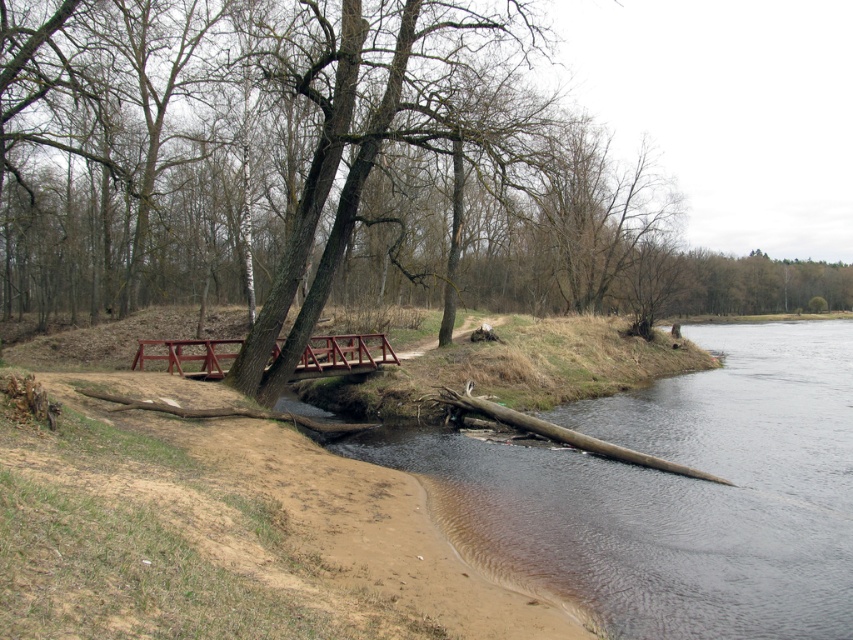
You are a hiker who wants to cross the river using the available structures. Can you use the metallic red bridge at center and the brown wood log at lower right to cross the river? Please explain your reasoning based on their sizes.

The metallic red bridge at center is larger in size than the brown wood log at lower right. Since the bridge is larger and more stable, it would be the safer option for crossing the river. The log might be too small or unstable for safe passage.

You are a hiker who wants to cross the river but need to avoid getting your boots wet. You see the metallic red bridge at center and the brown wood log at lower right. Which one can you use to cross the river without getting wet?

The metallic red bridge at center is located above brown wood log at lower right, so the metallic red bridge at center can be used to cross the river without getting wet since it is elevated above the water.

Consider the image. You are standing on the riverbank and want to cross to the other side. The metallic red bridge at center is the only structure available. Is the bridge located near the water or on the grassy area?

The metallic red bridge at center is located near the water because its 2D coordinates at point (343, 355) place it centrally over the stream flowing into the river, which is closer to the water than the grassy areas on either bank.